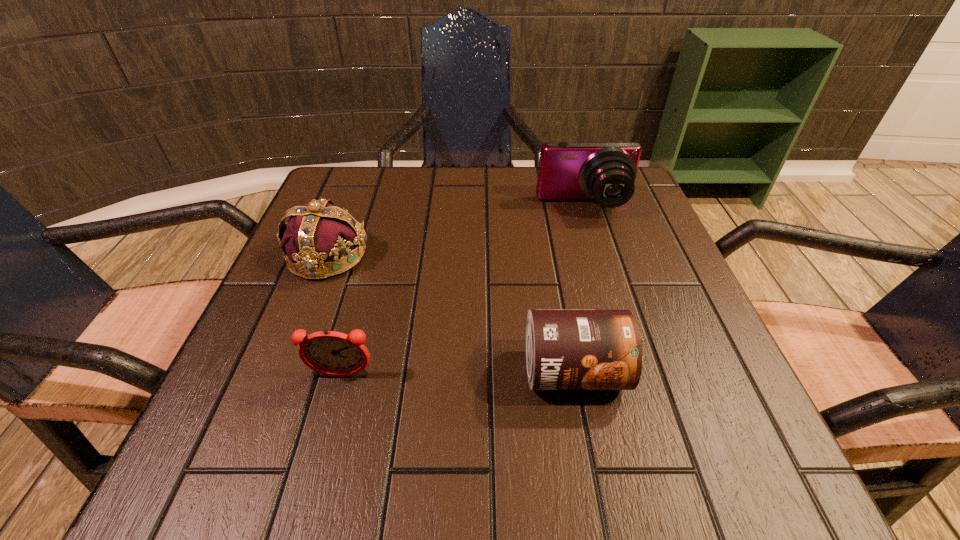
Where is `alarm clock that is positioned at the left edge`? This screenshot has height=540, width=960. alarm clock that is positioned at the left edge is located at coordinates (331, 353).

This screenshot has height=540, width=960. Find the location of `object positioned at the right edge`. object positioned at the right edge is located at coordinates (603, 171).

The height and width of the screenshot is (540, 960). I want to click on object that is at the far right corner, so click(x=603, y=171).

Find the location of a particular element. This screenshot has height=540, width=960. blank space at the far edge is located at coordinates click(x=407, y=194).

The width and height of the screenshot is (960, 540). In order to click on vacant space at the near edge of the desktop in this screenshot , I will do `click(342, 425)`.

The height and width of the screenshot is (540, 960). In the image, there is a desktop. What are the coordinates of `vacant region at the left edge` in the screenshot? It's located at (293, 350).

Locate an element on the screen. free region at the right edge is located at coordinates (725, 400).

The image size is (960, 540). Find the location of `free space at the far left corner of the desktop`. free space at the far left corner of the desktop is located at coordinates (346, 199).

In the image, there is a desktop. Where is `vacant region at the near right corner`? Image resolution: width=960 pixels, height=540 pixels. vacant region at the near right corner is located at coordinates (690, 475).

The image size is (960, 540). Find the location of `free space between the alarm clock and the can`. free space between the alarm clock and the can is located at coordinates (457, 374).